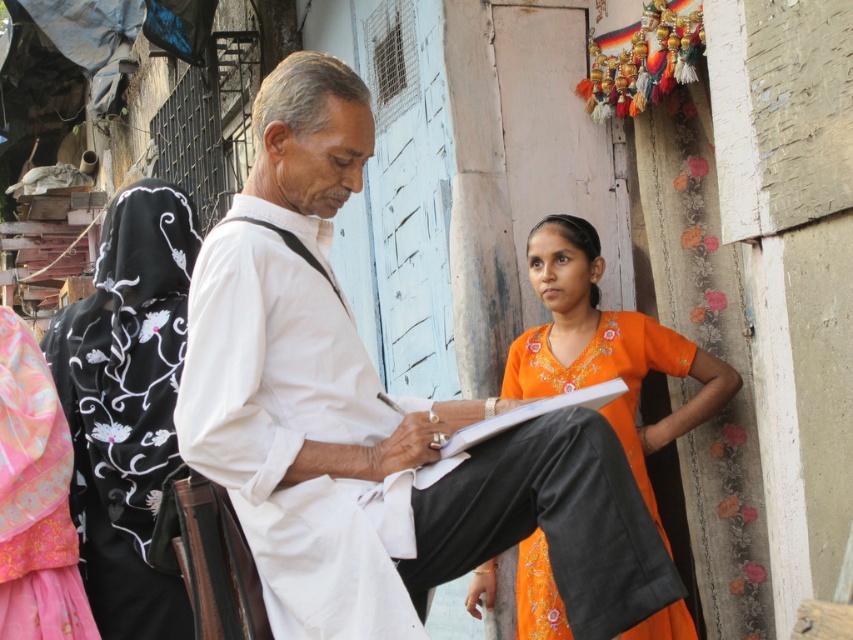
Question: Which point is farther to the camera?

Choices:
 (A) white cotton shirt at center
 (B) orange embroidered dress at right

Answer: (B)

Question: Does white cotton shirt at center come behind white paper clipboard at center?

Choices:
 (A) yes
 (B) no

Answer: (B)

Question: Which of the following is the farthest from the observer?

Choices:
 (A) (395, 596)
 (B) (148, 404)
 (C) (41, 576)
 (D) (413, 476)

Answer: (B)

Question: Is white cotton shirt at center below white paper clipboard at center?

Choices:
 (A) yes
 (B) no

Answer: (B)

Question: Which point is farther to the camera?

Choices:
 (A) white paper clipboard at center
 (B) black embroidered scarf at left

Answer: (B)

Question: Is black embroidered scarf at left to the right of white paper clipboard at center from the viewer's perspective?

Choices:
 (A) yes
 (B) no

Answer: (B)